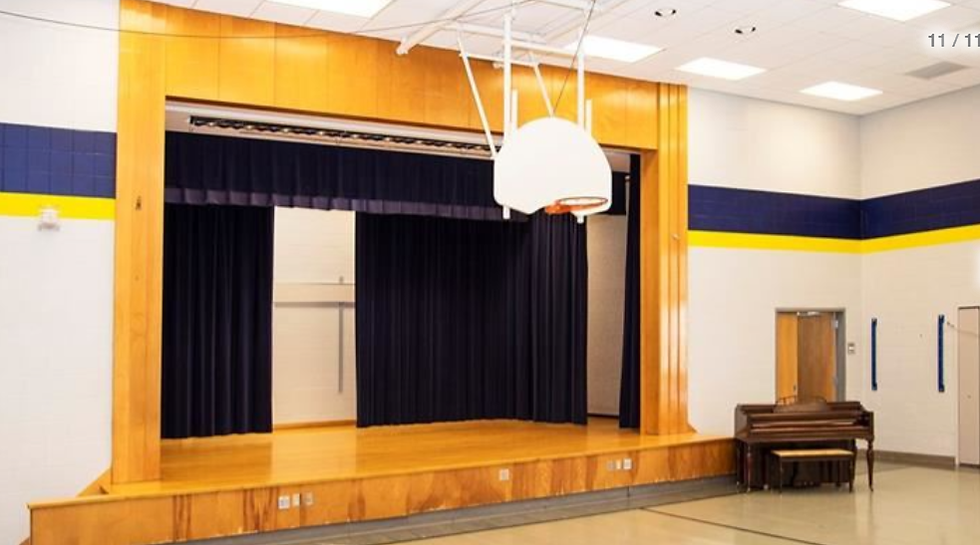
Find the location of a particular element. The height and width of the screenshot is (545, 980). doors is located at coordinates click(802, 354), click(974, 371).